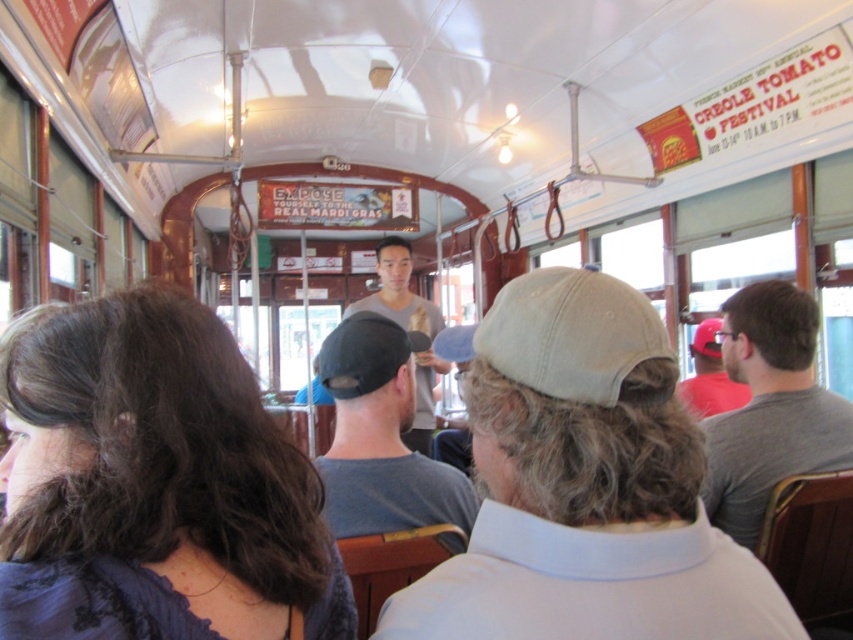
You are a passenger on the streetcar and want to pick up both the beige fabric baseball cap at center and the black fabric baseball cap at center. Which one should you reach for first to avoid disturbing the other?

The beige fabric baseball cap at center is located below the black fabric baseball cap at center, so you should reach for the black fabric baseball cap at center first to avoid disturbing the one below it.

You are a passenger on the vintage streetcar in New Orleans. You notice two points marked on the ceiling. The first point is at coordinate point(90,612) and the second is at point(843,401). If you are facing the front of the streetcar, which point is closer to the front of the vehicle?

Point(90,612) is in front of point(843,401), so it is closer to the front of the streetcar.

You are a passenger in the vintage streetcar and notice two baseball caps hanging from the overhead rack. The beige fabric baseball cap at center and the black fabric baseball cap at center. Which one is shorter in height?

The beige fabric baseball cap at center has a lesser height compared to the black fabric baseball cap at center, so the beige one is shorter.